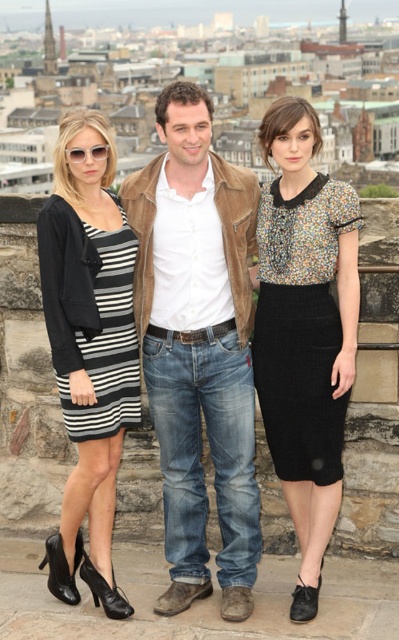
You are a photographer trying to capture a group photo of the multicolored knit top at center and the matte black sunglasses at upper left. The camera you are using has a maximum focus range of 7 meters. Will you be able to capture both subjects clearly in one shot?

The multicolored knit top at center and the matte black sunglasses at upper left are 7.40 meters apart from each other. Since the camera can only focus up to 7 meters, the distance between them exceeds the maximum focus range. Therefore, you won

In the scene shown: You are a photographer standing at the camera position. You want to take a photo of the striped cotton dress at center. Is the dress within your camera lens range? The camera can capture objects up to 25 meters away.

The striped cotton dress at center is 22.88 meters away from the camera. Since the camera can capture up to 25 meters, the dress is within range and can be photographed clearly.

You are a photographer trying to frame a shot of the striped cotton dress at center and the suede jacket at center. Which of these two items has a greater width?

The striped cotton dress at center has a greater width than the suede jacket at center.